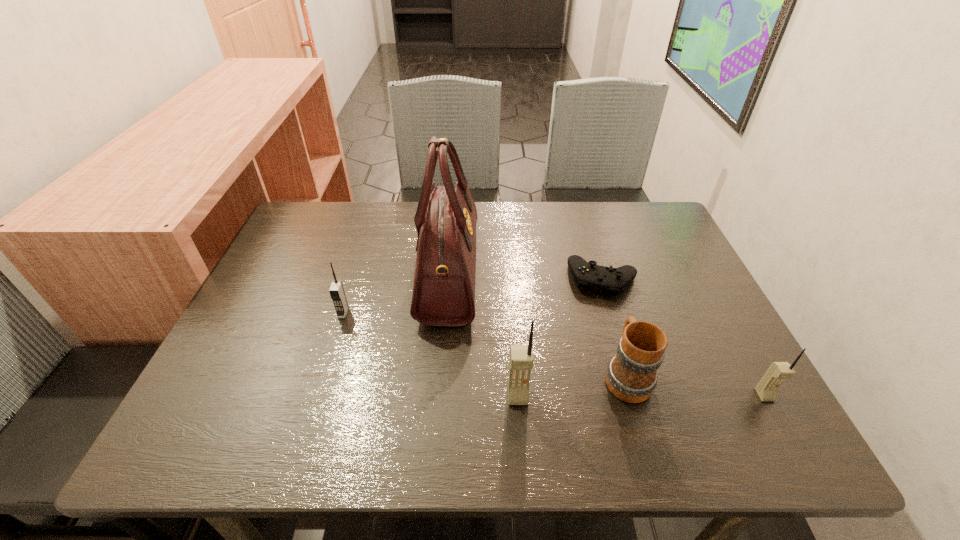
Locate an element on the screen. The width and height of the screenshot is (960, 540). vacant place for an extra cellular telephone on the left is located at coordinates (271, 396).